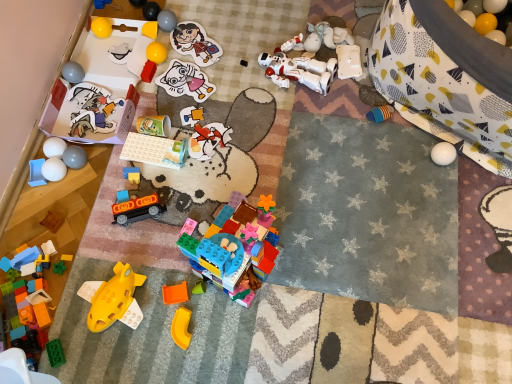
The image size is (512, 384). I want to click on vacant area that lies between matte paper sticker at center, the seventh toy viewed from the right, and white matte robot at upper center, positioned as the 23th toy in left-to-right order, so click(238, 82).